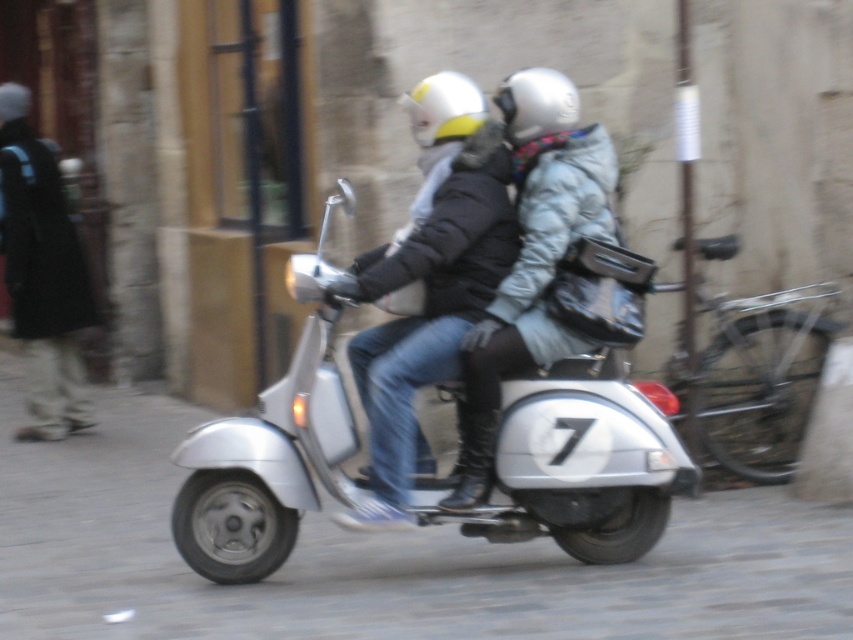
Question: Which point is closer to the camera?

Choices:
 (A) white matte helmet at upper center
 (B) white matte helmet at center
 (C) silver metallic scooter at center
 (D) black coat at left

Answer: (C)

Question: From the image, what is the correct spatial relationship of white matte helmet at center in relation to white matte helmet at upper center?

Choices:
 (A) left
 (B) right

Answer: (B)

Question: Which is farther from the metallic silver scooter at center?

Choices:
 (A) silver metallic scooter at center
 (B) black coat at left
 (C) white matte helmet at upper center
 (D) white matte helmet at center

Answer: (B)

Question: Among these objects, which one is farthest from the camera?

Choices:
 (A) black coat at left
 (B) white matte helmet at center
 (C) metallic silver scooter at center
 (D) silver metallic scooter at center

Answer: (A)

Question: Is silver metallic scooter at center smaller than black coat at left?

Choices:
 (A) no
 (B) yes

Answer: (B)

Question: In this image, where is black coat at left located relative to white matte helmet at upper center?

Choices:
 (A) left
 (B) right

Answer: (A)